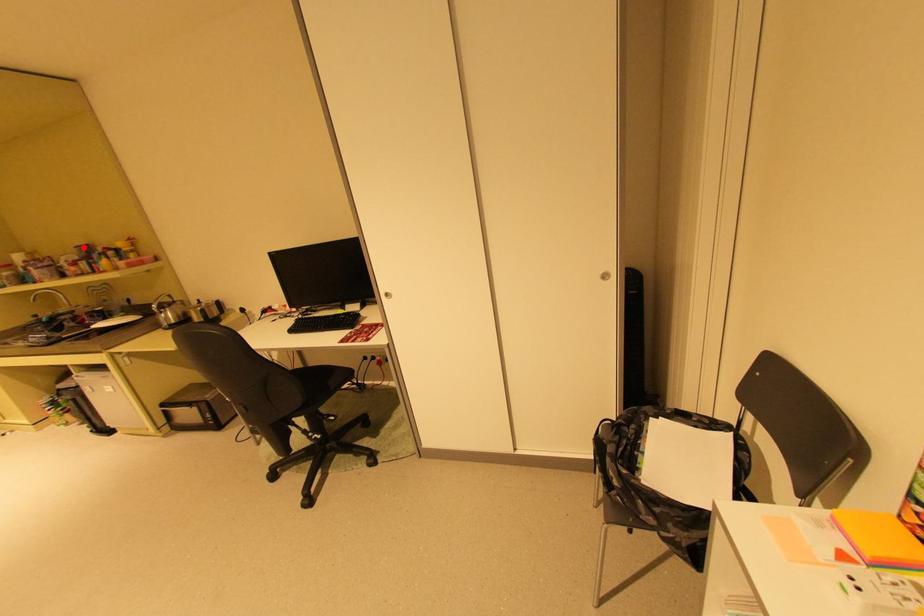
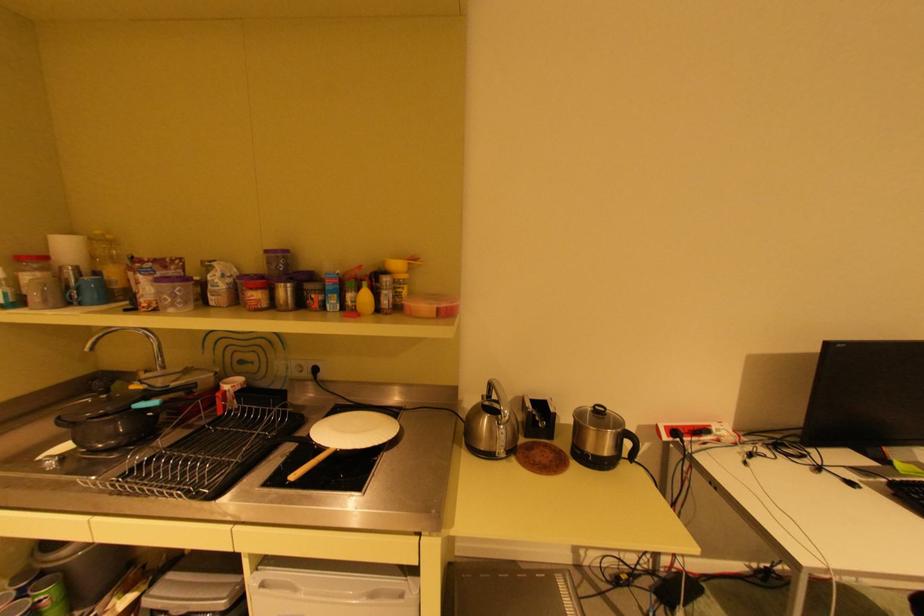
Locate, in the second image, the point that corresponds to the highlighted location in the first image.

(274, 251)